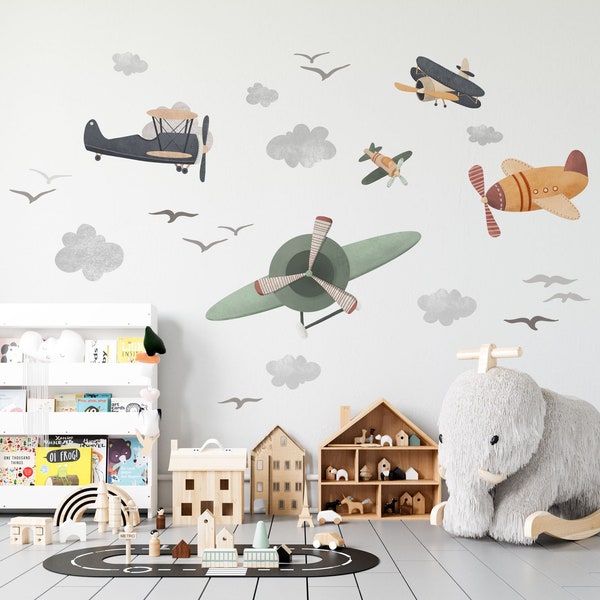
This screenshot has width=600, height=600. What are the coordinates of `toy human figure` in the screenshot? It's located at (161, 519), (155, 547).